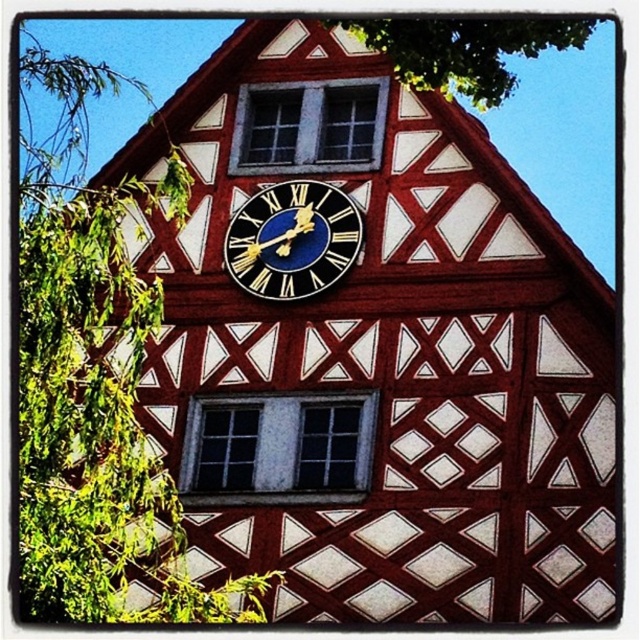
Question: Among these objects, which one is farthest from the camera?

Choices:
 (A) green leafy tree at left
 (B) green leafy tree at upper center

Answer: (B)

Question: Can you confirm if green leafy tree at upper center is positioned to the left of blue enamel clock at center?

Choices:
 (A) no
 (B) yes

Answer: (A)

Question: Is green leafy tree at left thinner than blue enamel clock at center?

Choices:
 (A) no
 (B) yes

Answer: (A)

Question: Is green leafy tree at upper center above blue enamel clock at center?

Choices:
 (A) no
 (B) yes

Answer: (B)

Question: Which point is farther to the camera?

Choices:
 (A) blue enamel clock at center
 (B) green leafy tree at left

Answer: (A)

Question: Among these points, which one is nearest to the camera?

Choices:
 (A) (355, 248)
 (B) (476, 72)

Answer: (B)